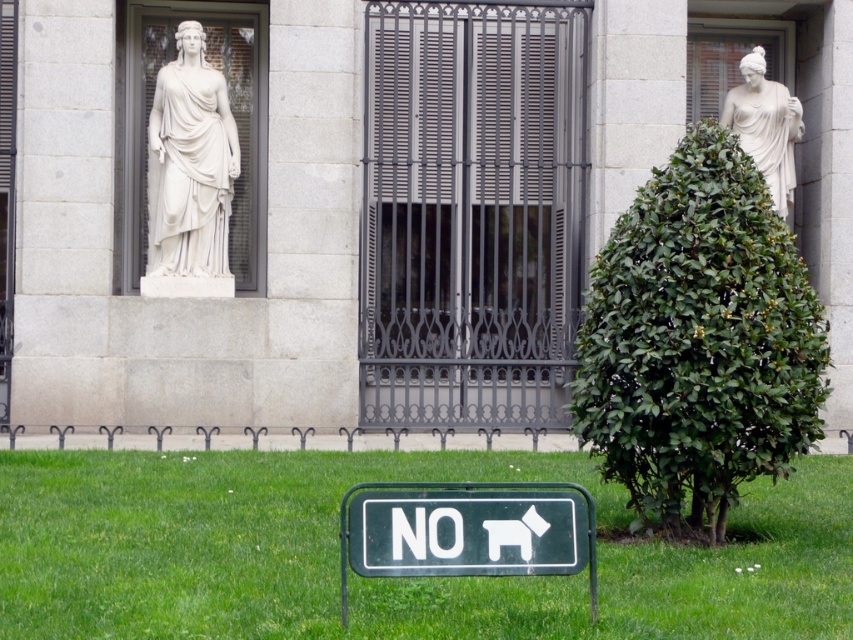
Question: From the image, what is the correct spatial relationship of white marble statue at left in relation to white marble statue at upper right?

Choices:
 (A) left
 (B) right

Answer: (A)

Question: Can you confirm if green grass at lower center is positioned above white marble statue at upper right?

Choices:
 (A) yes
 (B) no

Answer: (B)

Question: Which object appears closest to the camera in this image?

Choices:
 (A) green plastic sign at center
 (B) white marble statue at upper right
 (C) green leafy bush at right
 (D) green grass at lower center

Answer: (D)

Question: Estimate the real-world distances between objects in this image. Which object is farther from the green plastic sign at center?

Choices:
 (A) white marble statue at upper right
 (B) green grass at lower center
 (C) green leafy bush at right

Answer: (A)

Question: Can you confirm if white marble statue at left is positioned above white marble statue at upper right?

Choices:
 (A) no
 (B) yes

Answer: (A)

Question: Based on their relative distances, which object is farther from the green grass at lower center?

Choices:
 (A) white marble statue at left
 (B) green leafy bush at right

Answer: (A)